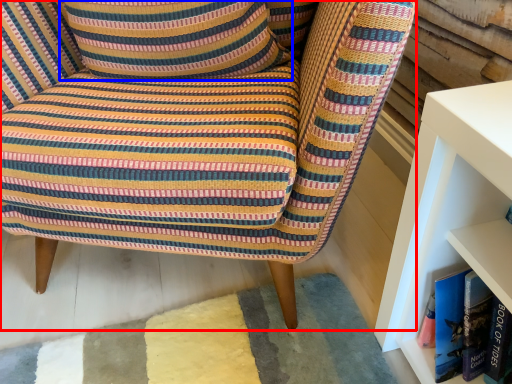
Question: Which object appears closest to the camera in this image, chair (highlighted by a red box) or pillow (highlighted by a blue box)?

Choices:
 (A) chair
 (B) pillow

Answer: (A)